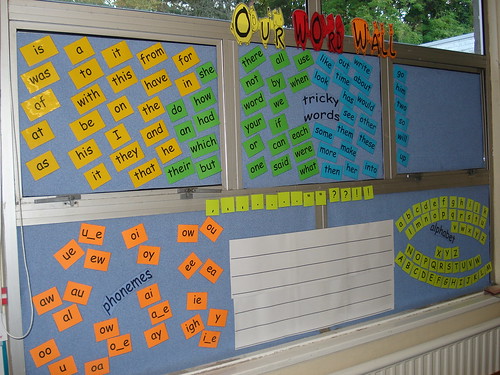
Locate an element on the screen. This screenshot has height=375, width=500. window covered with blue paper is located at coordinates (435, 120).